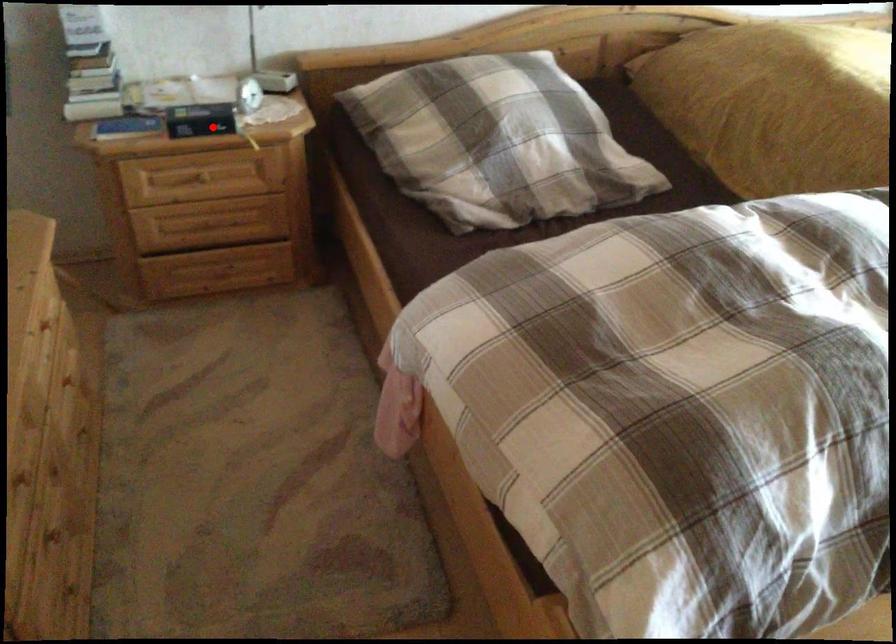
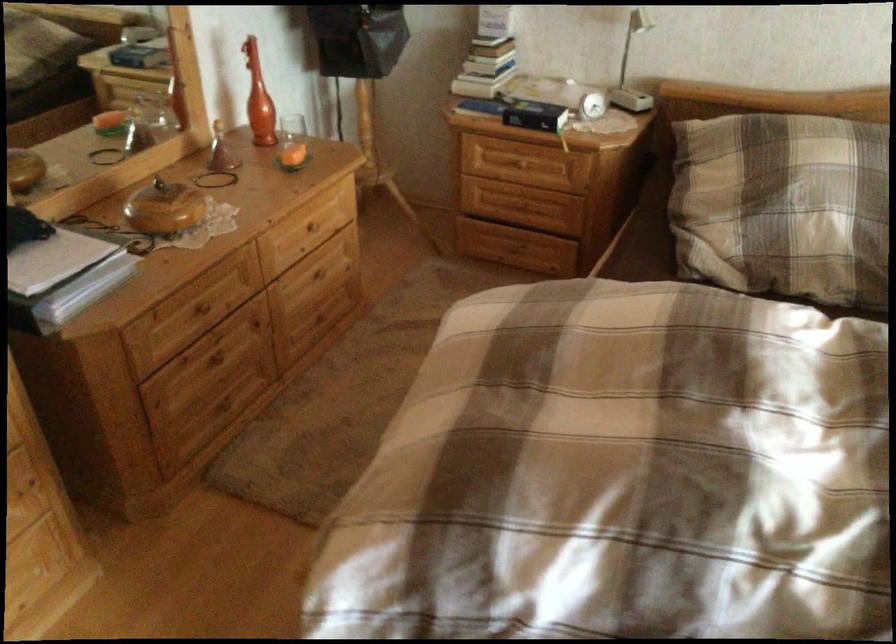
Question: I am providing you with two images of the same scene from different viewpoints. In image1, a red point is highlighted. Considering the same 3D point in image2, which of the following is correct?

Choices:
 (A) It is closer
 (B) It is farther

Answer: (B)